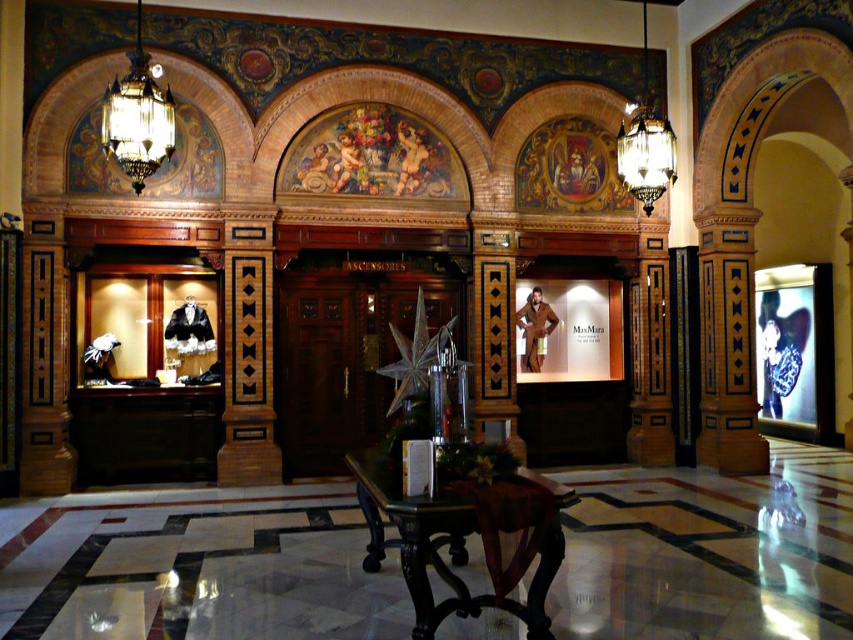
Question: Which of the following is the closest to the observer?

Choices:
 (A) glass crystal chandelier at upper left
 (B) matte glass chandelier at upper center

Answer: (A)

Question: Which point is closer to the camera?

Choices:
 (A) (531, 330)
 (B) (630, 116)

Answer: (B)

Question: Is glass crystal chandelier at upper left below brown leather jacket at center?

Choices:
 (A) yes
 (B) no

Answer: (B)

Question: Does glass crystal chandelier at upper left appear over matte glass chandelier at upper center?

Choices:
 (A) no
 (B) yes

Answer: (B)

Question: Which object is closer to the camera taking this photo?

Choices:
 (A) matte glass chandelier at upper center
 (B) glass crystal chandelier at upper left
 (C) brown leather jacket at center

Answer: (B)

Question: Does dark wood table at center come behind matte glass chandelier at upper center?

Choices:
 (A) no
 (B) yes

Answer: (A)